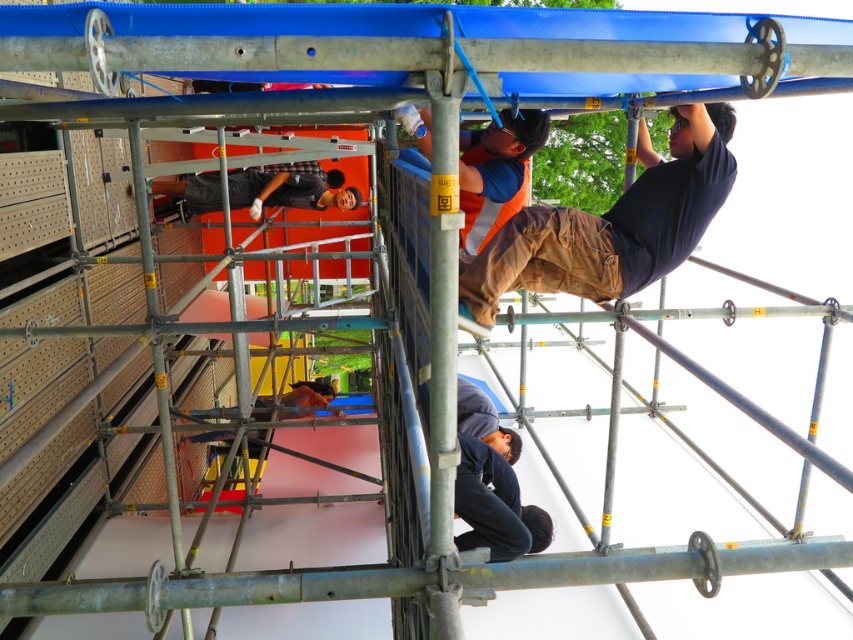
Question: Can you confirm if orange safety vest at upper center is positioned above orange reflective vest at upper center?

Choices:
 (A) no
 (B) yes

Answer: (A)

Question: Which point is farther from the camera taking this photo?

Choices:
 (A) (418, 152)
 (B) (227, 189)

Answer: (B)

Question: Can you confirm if orange safety vest at upper center is bigger than matte black shirt at center?

Choices:
 (A) no
 (B) yes

Answer: (A)

Question: Which point appears closest to the camera in this image?

Choices:
 (A) (428, 160)
 (B) (247, 198)
 (C) (596, 269)

Answer: (C)

Question: Is orange safety vest at upper center to the left of orange reflective vest at upper center from the viewer's perspective?

Choices:
 (A) yes
 (B) no

Answer: (B)

Question: Among these points, which one is farthest from the camera?

Choices:
 (A) (297, 198)
 (B) (541, 218)

Answer: (A)